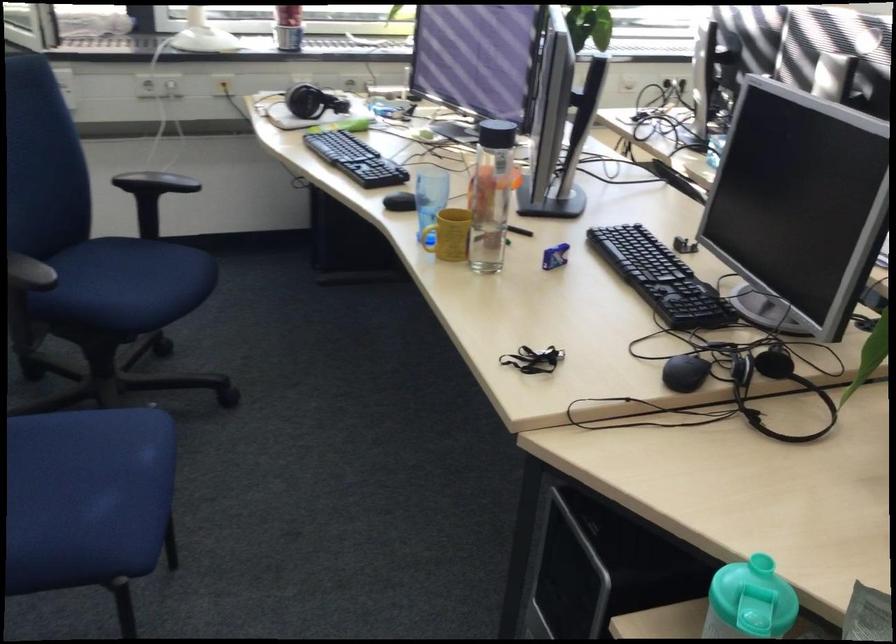
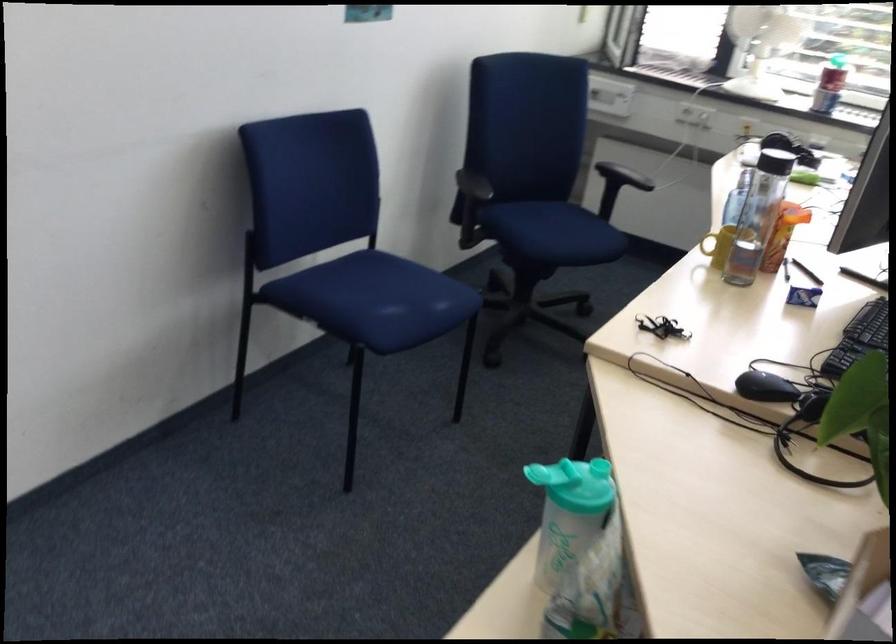
Find the pixel in the second image that matches point (670, 360) in the first image.

(765, 386)